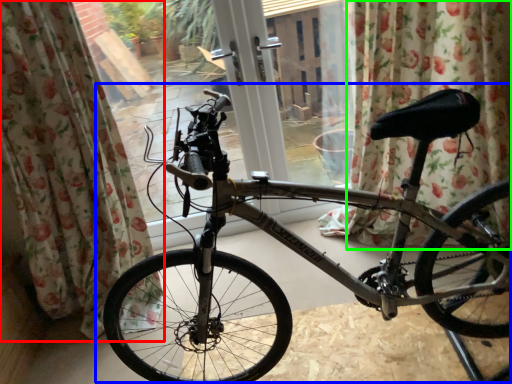
Question: Which object is positioned farthest from curtain (highlighted by a red box)? Select from bicycle (highlighted by a blue box) and curtain (highlighted by a green box).

Choices:
 (A) bicycle
 (B) curtain

Answer: (B)